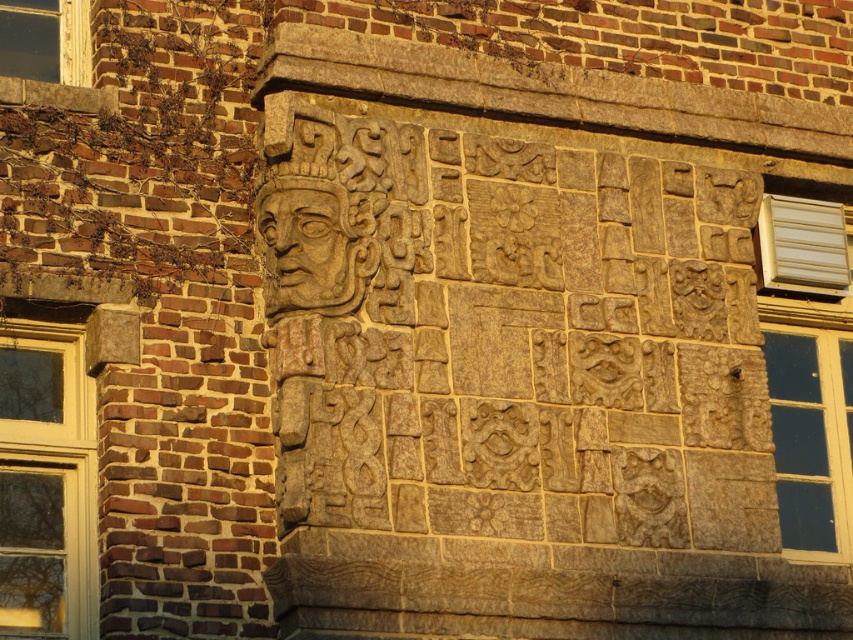
You are an architect analyzing the building facade. You need to determine if the carved stone face at upper center can be moved to the position currently occupied by the clear glass window at upper left. Based on their sizes, is this feasible?

The carved stone face at upper center is wider than the clear glass window at upper left, so moving it to the window position may not be feasible as it might not fit within the existing space.

You are standing in front of the building and want to install a new security camera. The camera requires a mounting bracket that can only be placed on an object with a height of at least 2 meters. Which object between the white plastic air conditioner at right and the clear glass window at upper left should you choose?

The clear glass window at upper left has a greater height than the white plastic air conditioner at right, so you should choose the clear glass window at upper left for mounting the security camera since it meets the height requirement of at least 2 meters.

Based on the photo, looking at the building exterior, which object is positioned to the right of the other between the carved stone face at upper center and the clear glass window at upper left?

The carved stone face at upper center is positioned to the right of the clear glass window at upper left.